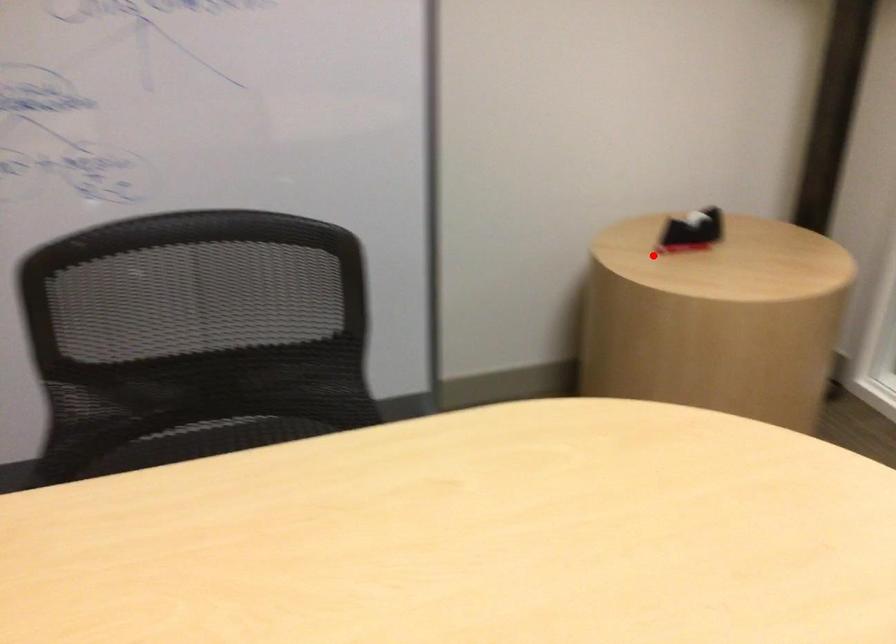
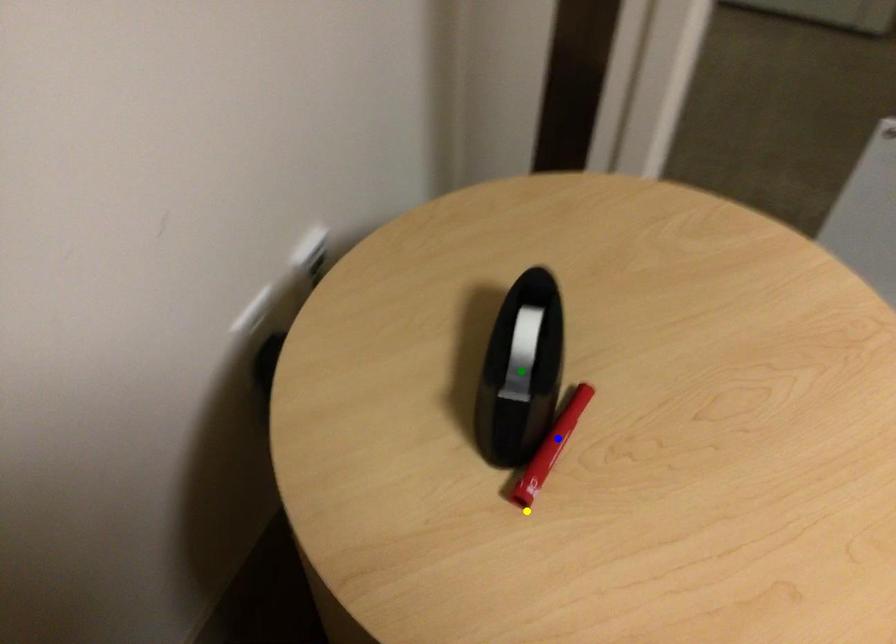
Question: I am providing you with two images of the same scene from different viewpoints. A red point is marked on the first image. You are given multiple points on the second image. Which point in image 2 is actually the same real-world point as the red point in image 1?

Choices:
 (A) yellow point
 (B) blue point
 (C) green point

Answer: (A)